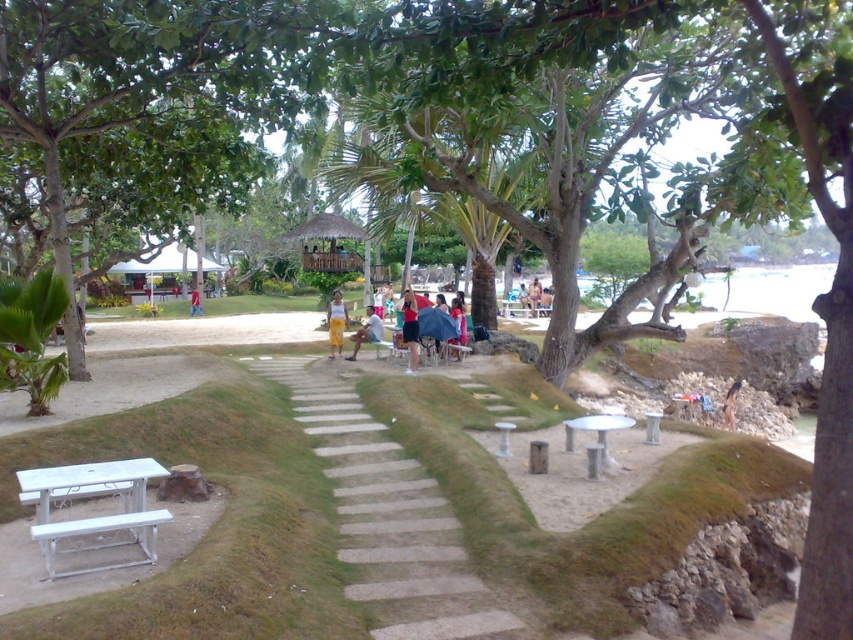
Question: Which of the following is the farthest from the observer?

Choices:
 (A) red shirt at center
 (B) white metallic park bench at lower left
 (C) yellow fabric skirt at center
 (D) light brown wooden bench at center

Answer: (D)

Question: Can you confirm if light gray concrete steps at center is bigger than light brown wooden bench at center?

Choices:
 (A) no
 (B) yes

Answer: (B)

Question: Observing the image, what is the correct spatial positioning of light gray concrete steps at center in reference to light brown wooden bench at center?

Choices:
 (A) below
 (B) above

Answer: (A)

Question: Among these objects, which one is farthest from the camera?

Choices:
 (A) white fabric umbrella at center
 (B) red shirt at center

Answer: (B)

Question: Does light gray concrete steps at center appear under red shirt at center?

Choices:
 (A) no
 (B) yes

Answer: (B)

Question: Which of these objects is positioned farthest from the white metallic park bench at lower left?

Choices:
 (A) white fabric umbrella at center
 (B) red shirt at center
 (C) yellow fabric skirt at center

Answer: (B)